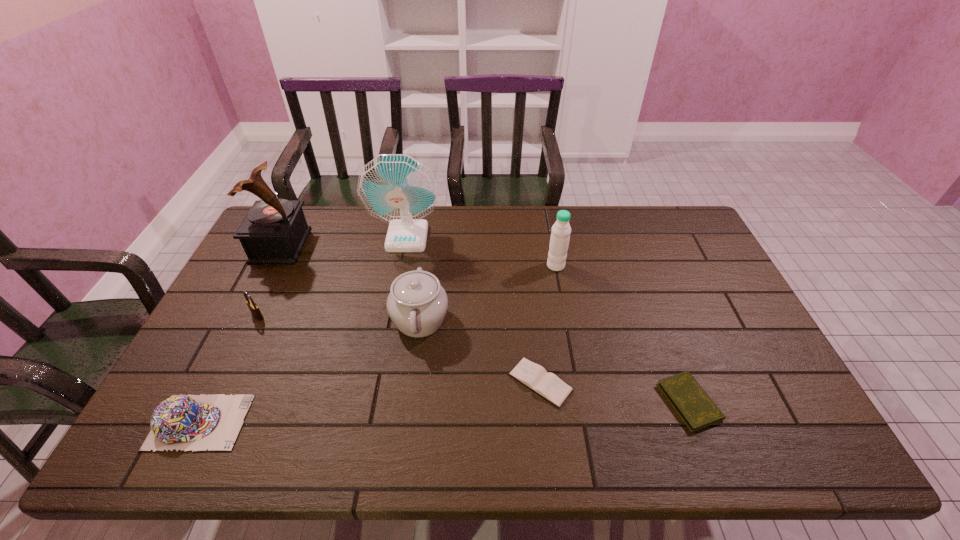
Locate an element on the screen. Image resolution: width=960 pixels, height=540 pixels. phonograph_record positioned at the left edge is located at coordinates (274, 231).

The height and width of the screenshot is (540, 960). Find the location of `padlock that is at the left edge`. padlock that is at the left edge is located at coordinates (254, 309).

Where is `cap located at the left edge`? cap located at the left edge is located at coordinates (183, 422).

Locate an element on the screen. object at the far left corner is located at coordinates (274, 231).

Where is `object that is at the near left corner`? The height and width of the screenshot is (540, 960). object that is at the near left corner is located at coordinates (183, 422).

You are a GUI agent. You are given a task and a screenshot of the screen. Output one action in this format:
    pyautogui.click(x=<x>, y=<y>)
    Task: Click on the vacant space at the far edge of the desktop
    The width and height of the screenshot is (960, 540).
    Given the screenshot: What is the action you would take?
    pyautogui.click(x=556, y=211)

You are a GUI agent. You are given a task and a screenshot of the screen. Output one action in this format:
    pyautogui.click(x=<x>, y=<y>)
    Task: Click on the vacant space at the near edge of the desktop
    
    Given the screenshot: What is the action you would take?
    pyautogui.click(x=535, y=441)

Where is `free space at the left edge of the desktop`? The image size is (960, 540). free space at the left edge of the desktop is located at coordinates (270, 287).

The height and width of the screenshot is (540, 960). Identify the location of free space at the right edge. (753, 402).

Where is `free space at the far right corner of the desktop`? free space at the far right corner of the desktop is located at coordinates (661, 217).